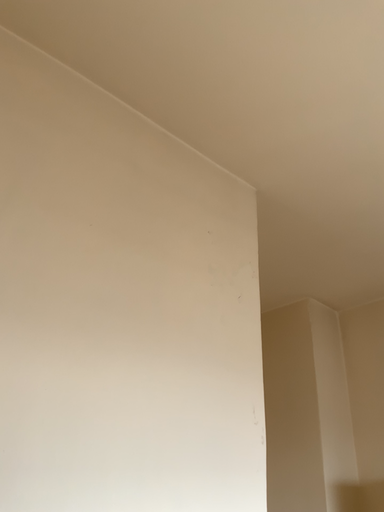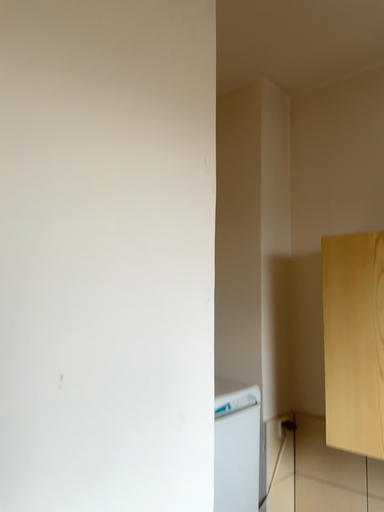
Question: How did the camera likely rotate when shooting the video?

Choices:
 (A) rotated right
 (B) rotated left

Answer: (A)